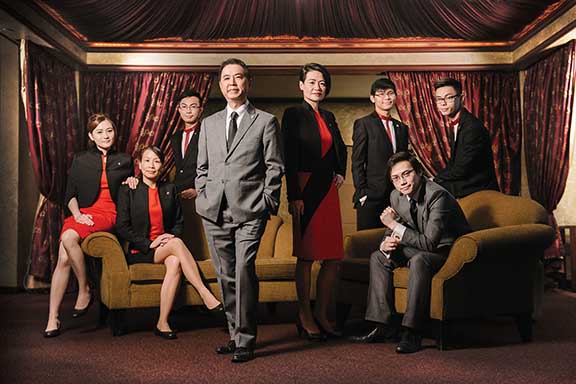
Where is `chair legs`? chair legs is located at coordinates (x=113, y=318), (x=525, y=324).